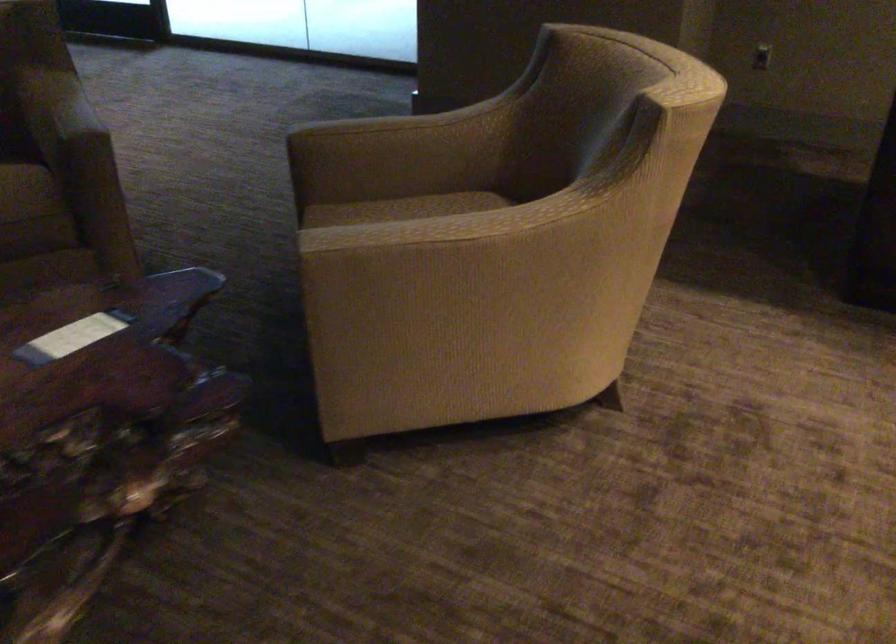
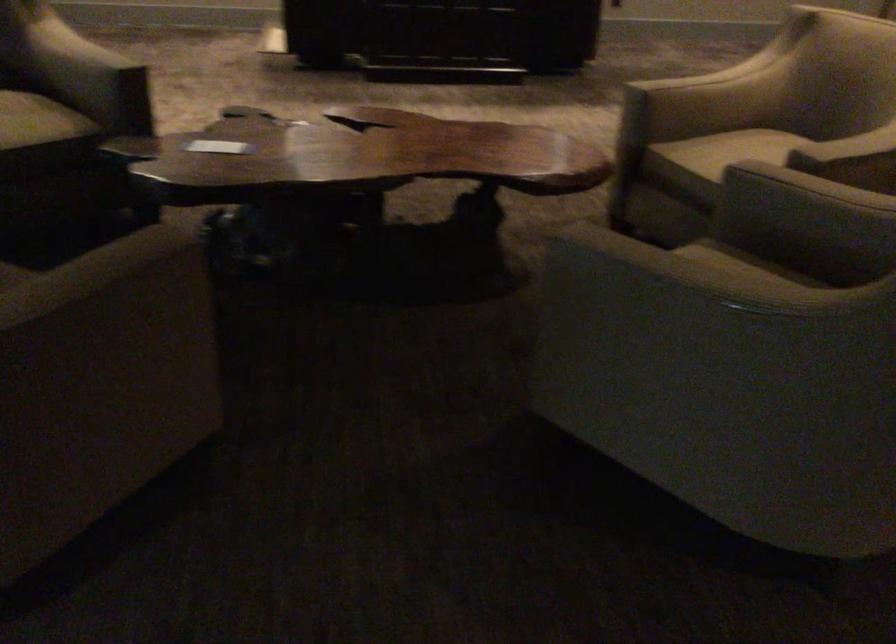
Locate, in the second image, the point that corresponds to pixel 110 317 in the first image.

(218, 146)